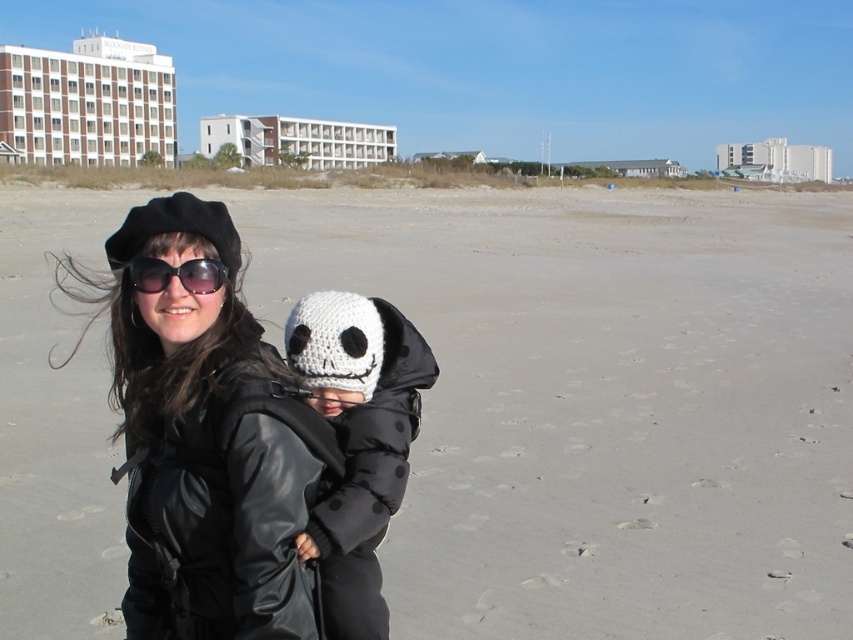
Question: Does matte black jacket at center have a smaller size compared to white knitted hat at center?

Choices:
 (A) yes
 (B) no

Answer: (B)

Question: Estimate the real-world distances between objects in this image. Which object is closer to the sunglasses at center?

Choices:
 (A) white knitted hat at center
 (B) matte black jacket at center
 (C) sandy beach at center

Answer: (B)

Question: Which point is farther to the camera?

Choices:
 (A) (317, 436)
 (B) (132, 276)

Answer: (B)

Question: Which point appears farthest from the camera in this image?

Choices:
 (A) (824, 544)
 (B) (206, 260)
 (C) (273, 483)

Answer: (A)

Question: Does sandy beach at center lie behind white knitted hat at center?

Choices:
 (A) yes
 (B) no

Answer: (A)

Question: Does matte black jacket at center come behind sunglasses at center?

Choices:
 (A) yes
 (B) no

Answer: (B)